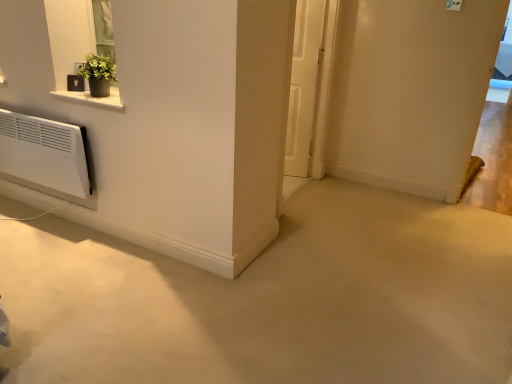
Question: Considering their positions, is green matte plant at upper left located in front of or behind white matte door at center?

Choices:
 (A) front
 (B) behind

Answer: (A)

Question: Would you say green matte plant at upper left is to the left or to the right of white matte door at center in the picture?

Choices:
 (A) right
 (B) left

Answer: (B)

Question: From a real-world perspective, is green matte plant at upper left physically located above or below white matte door at center?

Choices:
 (A) above
 (B) below

Answer: (A)

Question: From a real-world perspective, is white matte door at center physically located above or below green matte plant at upper left?

Choices:
 (A) above
 (B) below

Answer: (B)

Question: From the image's perspective, is white matte door at center positioned above or below green matte plant at upper left?

Choices:
 (A) above
 (B) below

Answer: (A)

Question: Considering the positions of point (295, 173) and point (82, 69), is point (295, 173) closer or farther from the camera than point (82, 69)?

Choices:
 (A) farther
 (B) closer

Answer: (A)

Question: In terms of width, does white matte door at center look wider or thinner when compared to green matte plant at upper left?

Choices:
 (A) wide
 (B) thin

Answer: (B)